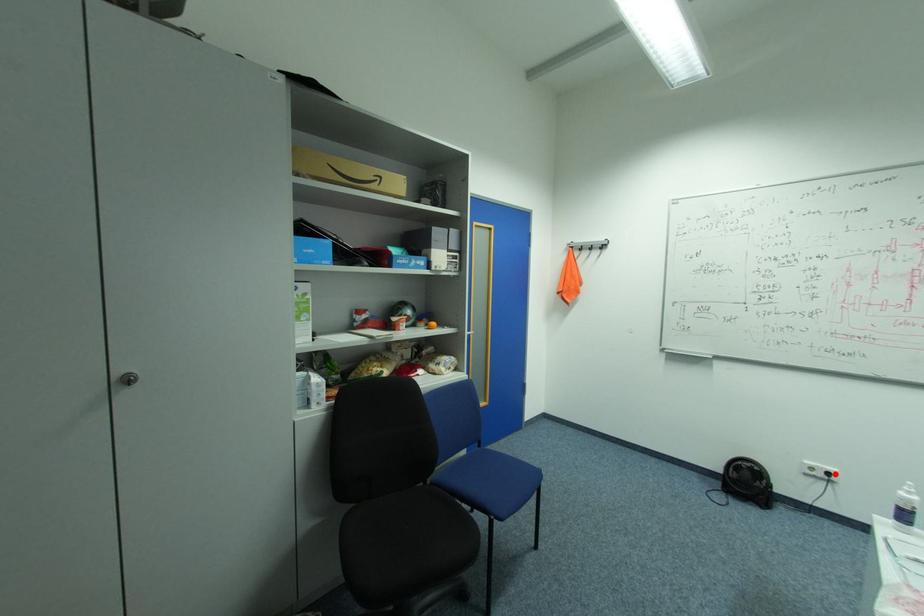
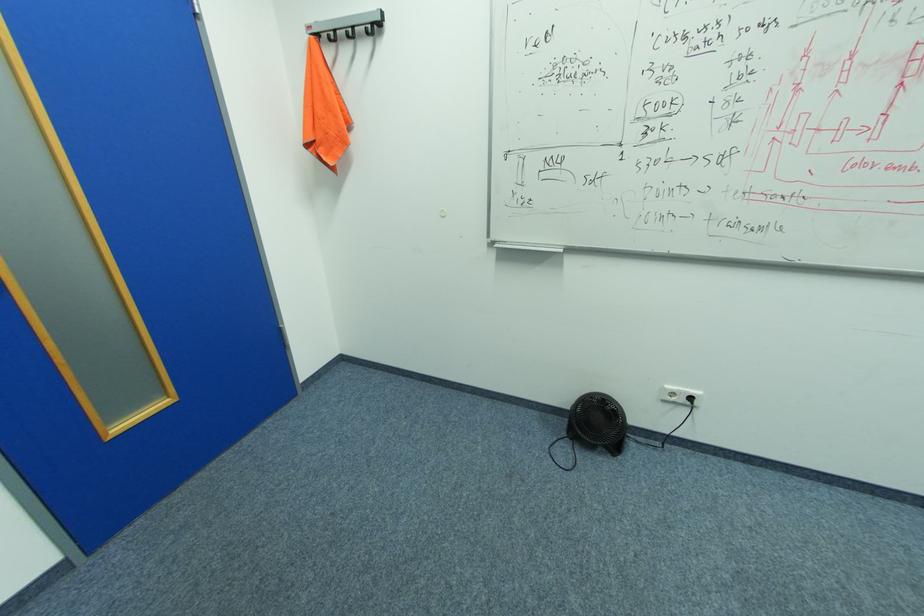
Question: I am providing you with two images of the same scene from different viewpoints. Given a red point in image1, look at the same physical point in image2. Is it:

Choices:
 (A) Closer to the viewpoint
 (B) Farther from the viewpoint

Answer: (A)